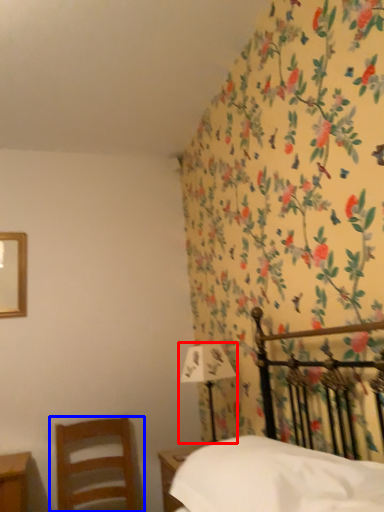
Question: Among these objects, which one is farthest to the camera, bedside lamp (highlighted by a red box) or chair (highlighted by a blue box)?

Choices:
 (A) bedside lamp
 (B) chair

Answer: (A)